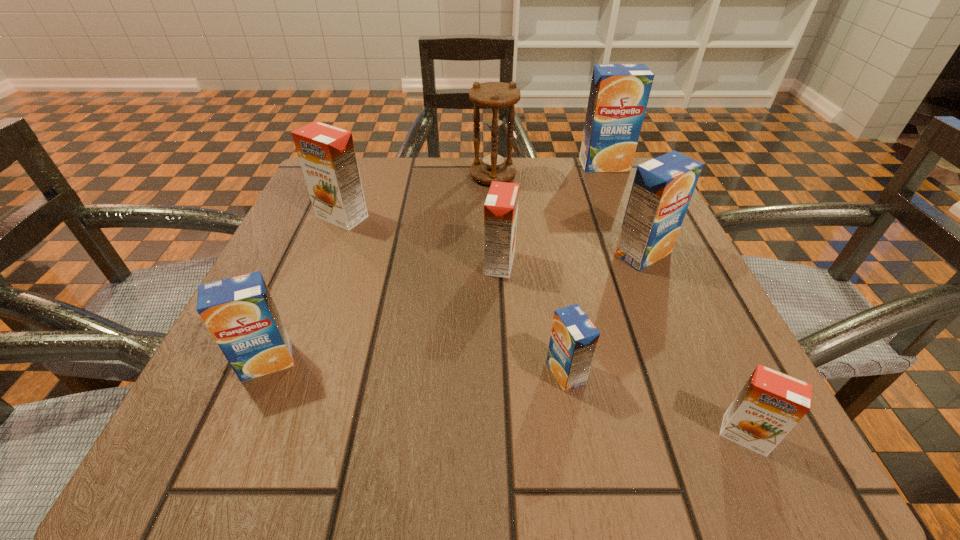
Locate an element on the screen. free spot located 0.170m on the left of the nearest orange juice is located at coordinates (582, 435).

Locate an element on the screen. The height and width of the screenshot is (540, 960). hourglass that is positioned at the far edge is located at coordinates (494, 164).

Find the location of a particular element. The width and height of the screenshot is (960, 540). object present at the near edge is located at coordinates [x=769, y=405].

The image size is (960, 540). I want to click on object situated at the far left corner, so click(x=327, y=155).

At what (x,y) coordinates should I click in order to perform the action: click on object that is at the far right corner. Please return your answer as a coordinate pair (x, y). Image resolution: width=960 pixels, height=540 pixels. Looking at the image, I should click on (619, 93).

This screenshot has height=540, width=960. What are the coordinates of `object situated at the near right corner` in the screenshot? It's located at (769, 405).

The width and height of the screenshot is (960, 540). In the image, there is a desktop. Find the location of `vacant space at the far edge`. vacant space at the far edge is located at coordinates tap(379, 207).

Locate an element on the screen. The height and width of the screenshot is (540, 960). vacant space at the near edge of the desktop is located at coordinates (389, 411).

The height and width of the screenshot is (540, 960). In the image, there is a desktop. Identify the location of vacant area at the left edge. (290, 240).

Find the location of a particular element. This screenshot has height=540, width=960. vacant space at the right edge is located at coordinates (704, 311).